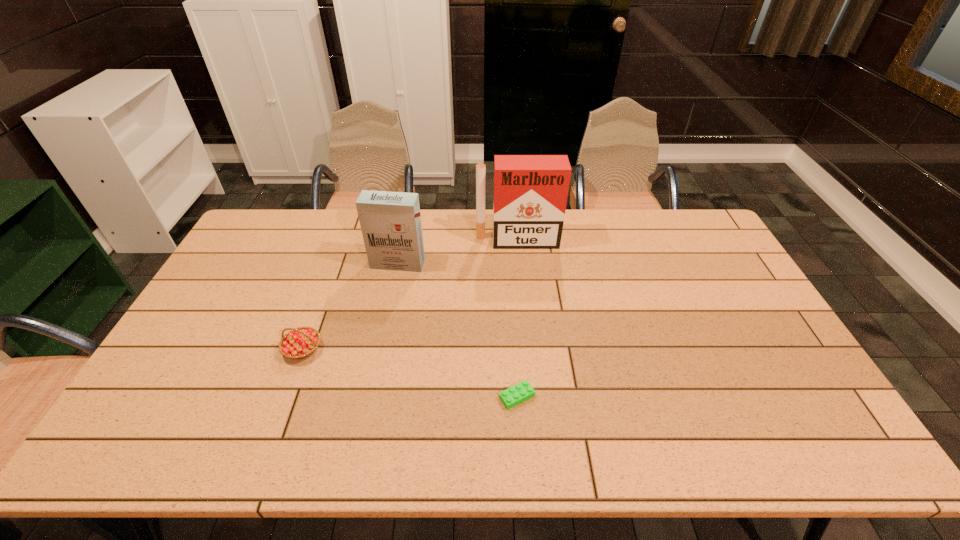
In order to click on the right cigarette case in this screenshot , I will do `click(530, 195)`.

Identify the location of the tallest object. This screenshot has width=960, height=540. (530, 195).

Image resolution: width=960 pixels, height=540 pixels. In order to click on the second tallest object in this screenshot , I will do `click(390, 222)`.

Where is `the nearer cigarette case`? the nearer cigarette case is located at coordinates (390, 222).

Identify the location of the leftmost object. The width and height of the screenshot is (960, 540). (299, 343).

The width and height of the screenshot is (960, 540). I want to click on the second shortest object, so click(x=299, y=343).

Identify the location of Lego. The image size is (960, 540). (519, 393).

The height and width of the screenshot is (540, 960). I want to click on the shortest object, so click(519, 393).

You are a GUI agent. You are given a task and a screenshot of the screen. Output one action in this format:
    pyautogui.click(x=<x>, y=<y>)
    Task: Click on the free location located on the front-facing side of the right cigarette case
    
    Given the screenshot: What is the action you would take?
    pyautogui.click(x=522, y=293)

The width and height of the screenshot is (960, 540). In order to click on vacant space situated 0.160m on the left of the nearer cigarette case in this screenshot , I will do `click(324, 264)`.